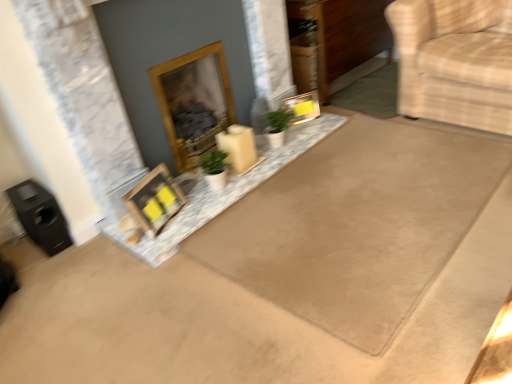
The width and height of the screenshot is (512, 384). I want to click on vacant region above beige carpet at center, marked as the first doormat in a left-to-right arrangement (from a real-world perspective), so click(x=319, y=210).